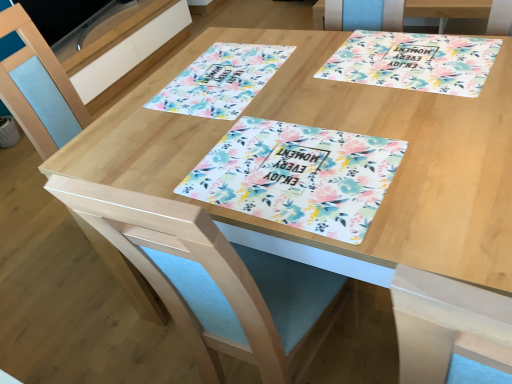
In order to click on unoccupied region to the right of floral paper placemat at center, the 2th flyer positioned from the top in this screenshot , I will do `click(424, 127)`.